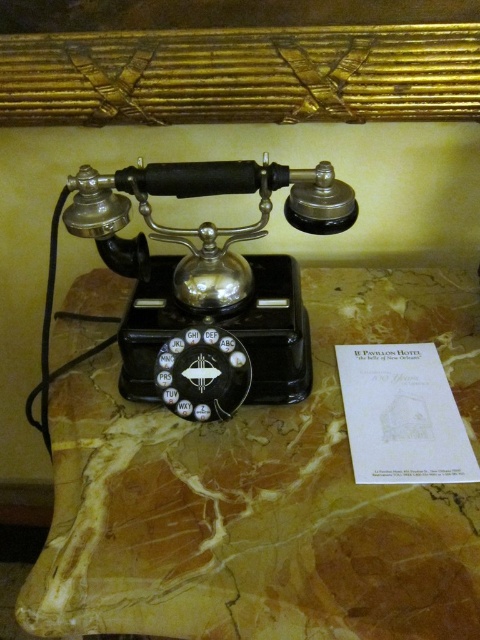
Between marble at center and black polished rotary phone at center, which one appears on the right side from the viewer's perspective?

From the viewer's perspective, marble at center appears more on the right side.

Is marble at center to the left of black polished rotary phone at center from the viewer's perspective?

Incorrect, marble at center is not on the left side of black polished rotary phone at center.

Does point (397, 636) lie in front of point (199, 276)?

Yes, it is.

I want to click on marble at center, so click(264, 497).